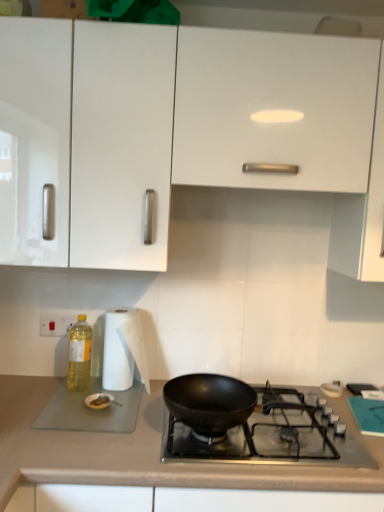
At what (x,y) coordinates should I click in order to perform the action: click on black matte wok at center. Please return your answer as a coordinate pair (x, y). The height and width of the screenshot is (512, 384). Looking at the image, I should click on (209, 402).

Describe the element at coordinates (273, 434) in the screenshot. This screenshot has width=384, height=512. I see `black matte wok at center` at that location.

Locate an element on the screen. black matte wok at center is located at coordinates (273, 434).

This screenshot has height=512, width=384. Describe the element at coordinates (56, 324) in the screenshot. I see `white plastic electric outlet at lower left` at that location.

You are a GUI agent. You are given a task and a screenshot of the screen. Output one action in this format:
    pyautogui.click(x=<x>, y=<y>)
    Task: Click on the black matte wok at center
    
    Given the screenshot: What is the action you would take?
    pyautogui.click(x=209, y=402)

In terms of size, does yellow translucent bottle at left appear bigger or smaller than white plastic electric outlet at lower left?

yellow translucent bottle at left is bigger than white plastic electric outlet at lower left.

Choose the correct answer: Is yellow translucent bottle at left inside white plastic electric outlet at lower left or outside it?

The correct answer is: outside.

Which object is positioned more to the right, yellow translucent bottle at left or white plastic electric outlet at lower left?

yellow translucent bottle at left.

Can you confirm if yellow translucent bottle at left is shorter than white plastic electric outlet at lower left?

In fact, yellow translucent bottle at left may be taller than white plastic electric outlet at lower left.

Which point is more distant from viewer, (66, 326) or (106, 330)?

Positioned behind is point (66, 326).

Is white plastic electric outlet at lower left not near white paper towel at left?

No, white plastic electric outlet at lower left is in close proximity to white paper towel at left.

Is white plastic electric outlet at lower left positioned with its back to white paper towel at left?

No, white plastic electric outlet at lower left is not facing away from white paper towel at left.

From the image's perspective, is white plastic electric outlet at lower left located beneath white paper towel at left?

No, from the image's perspective, white plastic electric outlet at lower left is not below white paper towel at left.

Between black matte wok at center and white paper towel at left, which one is positioned behind?

white paper towel at left is more distant.

Is black matte wok at center far away from white paper towel at left?

No, there isn't a large distance between black matte wok at center and white paper towel at left.

Does point (169, 451) lie behind point (108, 356)?

No, (169, 451) is closer to viewer.

Considering the sizes of objects yellow translucent bottle at left and smooth beige countertop at lower center in the image provided, who is wider, yellow translucent bottle at left or smooth beige countertop at lower center?

With larger width is smooth beige countertop at lower center.

How many degrees apart are the facing directions of yellow translucent bottle at left and smooth beige countertop at lower center?

The facing directions of yellow translucent bottle at left and smooth beige countertop at lower center are 0.696 degrees apart.

In terms of height, does yellow translucent bottle at left look taller or shorter compared to smooth beige countertop at lower center?

yellow translucent bottle at left is shorter than smooth beige countertop at lower center.

Image resolution: width=384 pixels, height=512 pixels. I want to click on countertop beneath the yellow translucent bottle at left (from a real-world perspective), so click(142, 452).

From the image's perspective, between yellow translucent bottle at left and white glossy cabinet at upper center, which one is located above?

white glossy cabinet at upper center is shown above in the image.

Is yellow translucent bottle at left turned away from white glossy cabinet at upper center?

No, yellow translucent bottle at left is not facing away from white glossy cabinet at upper center.

How many degrees apart are the facing directions of yellow translucent bottle at left and white glossy cabinet at upper center?

The angle between the facing direction of yellow translucent bottle at left and the facing direction of white glossy cabinet at upper center is 1.3 degrees.

Which of these two, yellow translucent bottle at left or white glossy cabinet at upper center, is bigger?

Bigger between the two is white glossy cabinet at upper center.

Find the location of `bottle above the black matte wok at center (from the image's perspective)`. bottle above the black matte wok at center (from the image's perspective) is located at coordinates (79, 355).

Is black matte wok at center in front of yellow translucent bottle at left?

Yes, black matte wok at center is closer to the camera.

From a real-world perspective, which object rests below the other?

From a 3D spatial view, black matte wok at center is below.

How different are the orientations of black matte wok at center and yellow translucent bottle at left in degrees?

The angular difference between black matte wok at center and yellow translucent bottle at left is 1.3 degrees.

Can we say white plastic electric outlet at lower left lies outside black matte wok at center?

Yes, white plastic electric outlet at lower left is outside of black matte wok at center.

I want to click on electric outlet that appears behind the black matte wok at center, so click(56, 324).

From a real-world perspective, which object stands above the other?

white plastic electric outlet at lower left, from a real-world perspective.

Would you consider white plastic electric outlet at lower left to be distant from black matte wok at center?

No, white plastic electric outlet at lower left is not far from black matte wok at center.

At what (x,y) coordinates should I click in order to perform the action: click on electric outlet behind the yellow translucent bottle at left. Please return your answer as a coordinate pair (x, y). This screenshot has height=512, width=384. Looking at the image, I should click on (56, 324).

The image size is (384, 512). In order to click on electric outlet above the white paper towel at left (from the image's perspective) in this screenshot , I will do `click(56, 324)`.

Estimate the real-world distances between objects in this image. Which object is closer to black matte wok at center, white glossy cabinet at upper center or smooth beige countertop at lower center?

The object closer to black matte wok at center is smooth beige countertop at lower center.

When comparing their distances from white paper towel at left, does white plastic electric outlet at lower left or black matte wok at center seem further?

Among the two, black matte wok at center is located further to white paper towel at left.

Looking at the image, which one is located closer to smooth beige countertop at lower center, white glossy cabinet at upper center or white plastic electric outlet at lower left?

The object closer to smooth beige countertop at lower center is white plastic electric outlet at lower left.

Looking at the image, which one is located further to white plastic electric outlet at lower left, white paper towel at left or black matte wok at center?

black matte wok at center is further to white plastic electric outlet at lower left.

Based on the photo, considering their positions, is white plastic electric outlet at lower left positioned further to smooth beige countertop at lower center than black matte wok at center?

white plastic electric outlet at lower left is further to smooth beige countertop at lower center.

Looking at this image, which object lies nearer to the anchor point white paper towel at left, yellow translucent bottle at left or black matte wok at center?

yellow translucent bottle at left is positioned closer to the anchor white paper towel at left.

From the image, which object appears to be nearer to white glossy cabinet at upper center, smooth beige countertop at lower center or white paper towel at left?

white paper towel at left.

Looking at this image, considering their positions, is smooth beige countertop at lower center positioned closer to yellow translucent bottle at left than black matte wok at center?

smooth beige countertop at lower center lies closer to yellow translucent bottle at left than the other object.

Find the location of a particular element. The width and height of the screenshot is (384, 512). bottle between white glossy cabinet at upper center and smooth beige countertop at lower center vertically is located at coordinates (79, 355).

Image resolution: width=384 pixels, height=512 pixels. Find the location of `paper towel between white plastic electric outlet at lower left and black matte wok at center`. paper towel between white plastic electric outlet at lower left and black matte wok at center is located at coordinates (123, 350).

This screenshot has height=512, width=384. I want to click on paper towel between white glossy cabinet at upper center and smooth beige countertop at lower center in the vertical direction, so click(x=123, y=350).

Locate an element on the screen. This screenshot has height=512, width=384. bottle that lies between white glossy cabinet at upper center and black matte wok at center from top to bottom is located at coordinates (79, 355).